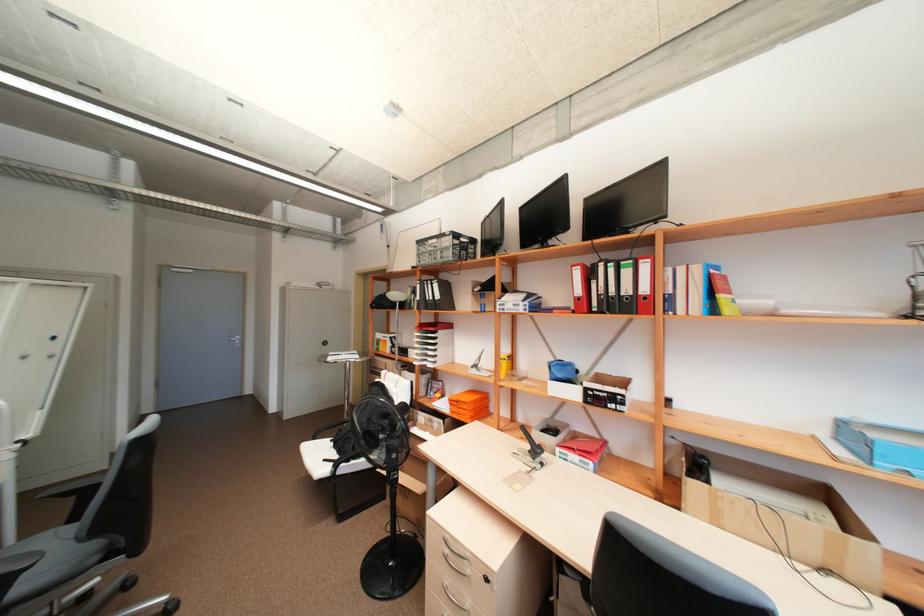
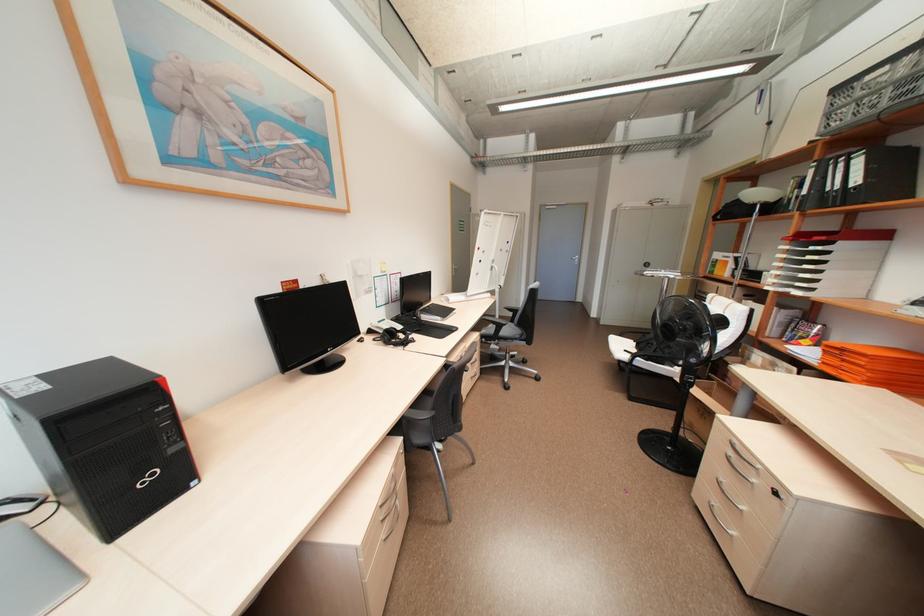
Question: Based on the continuous images, in which direction is the camera rotating? Reply with the corresponding letter.

Choices:
 (A) Left
 (B) Right
 (C) Up
 (D) Down

Answer: (A)